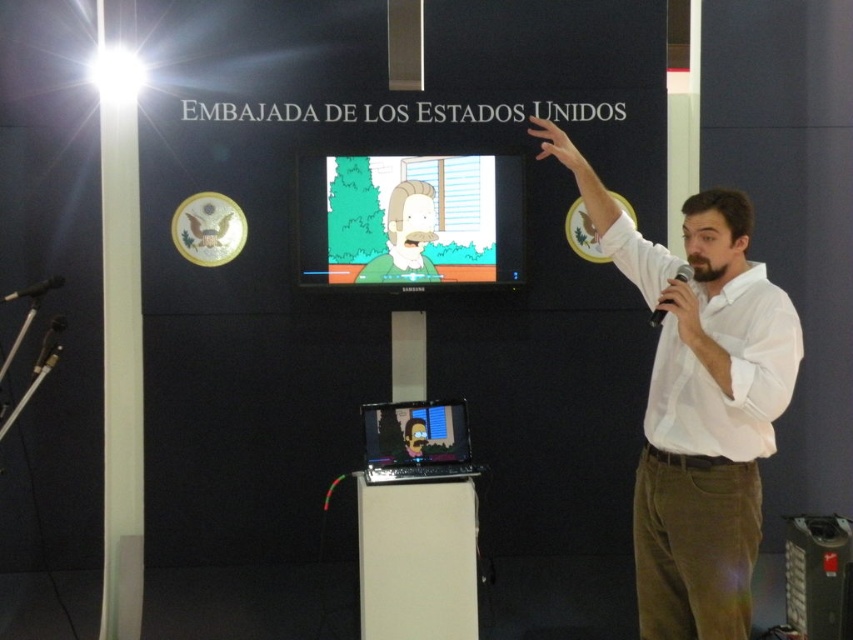
Question: Which point is closer to the camera taking this photo?

Choices:
 (A) (685, 298)
 (B) (408, 253)

Answer: (A)

Question: Which object is closer to the camera taking this photo?

Choices:
 (A) black plastic microphone at upper right
 (B) cartoonish plastic tv at center
 (C) black matte microphone at left
 (D) white shirt at upper right

Answer: (D)

Question: Is the position of matte black laptop at right less distant than that of matte white hand at upper right?

Choices:
 (A) yes
 (B) no

Answer: (B)

Question: Can you confirm if white shirt at upper right is positioned to the left of cartoonish plastic tv at center?

Choices:
 (A) no
 (B) yes

Answer: (A)

Question: Estimate the real-world distances between objects in this image. Which object is farther from the black plastic microphone at upper right?

Choices:
 (A) matte black hand at upper center
 (B) cartoonish plastic tv at center

Answer: (B)

Question: Where is matte black screen at center located in relation to matte white hand at upper right in the image?

Choices:
 (A) above
 (B) below

Answer: (B)